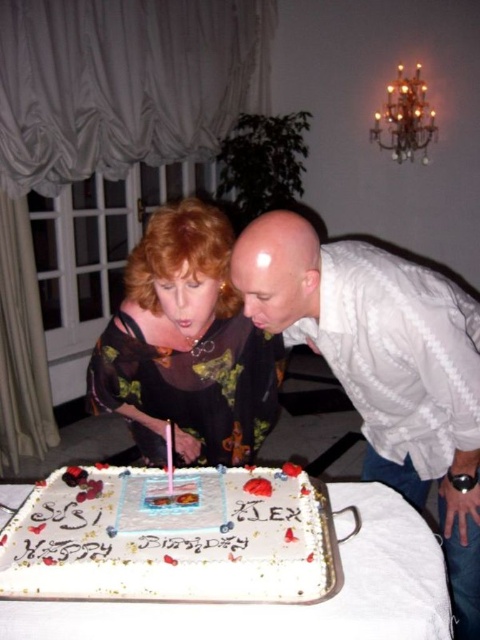
Based on the photo, you are a photographer setting up a camera to capture the birthday scene. You need to ensure both the white textured shirt at center and the matte black dress at center are fully visible in the frame. Based on their positions and sizes, which clothing item might require more careful framing to avoid being cropped out?

The white textured shirt at center might be wider than the matte black dress at center, so it could require more careful framing to ensure it fits entirely within the camera frame without being cropped out.

You are a photographer standing in front of the scene. You want to take a photo of the white textured shirt at center and the white cardboard cake at center. Which object should you focus on first if you want to capture both clearly in the same frame?

The white textured shirt at center has a greater height compared to the white cardboard cake at center. To capture both clearly in the same frame, focus on the white textured shirt at center first since it is taller and might require more attention in the composition.

You are a photographer at the birthday party. You need to take a photo of the white textured shirt at center and the white cardboard cake at center. Which one is positioned higher in the frame?

The white textured shirt at center is above the white cardboard cake at center, so it is positioned higher in the frame.